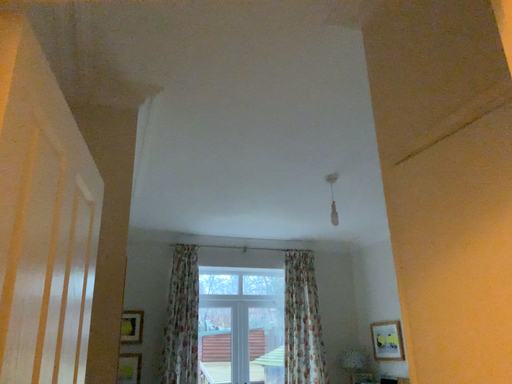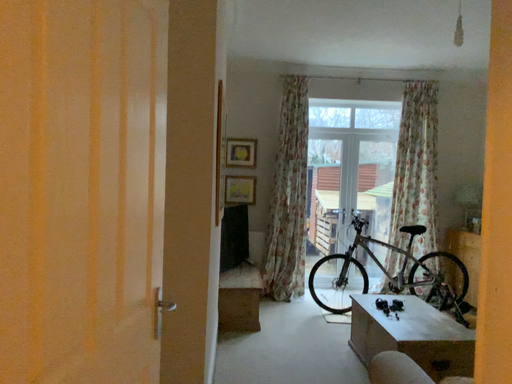
Question: Which way did the camera rotate in the video?

Choices:
 (A) rotated upward
 (B) rotated downward

Answer: (B)